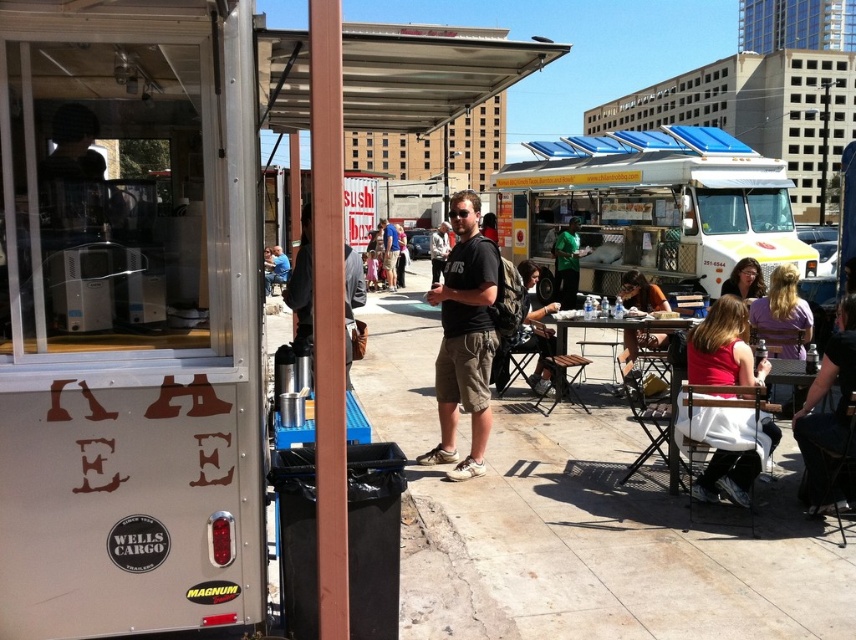
Question: Which point is farther from the camera taking this photo?

Choices:
 (A) 395,275
 (B) 554,337
 (C) 717,305
 (D) 486,285

Answer: (A)

Question: Is the position of camouflage jacket at center more distant than that of wooden table at center?

Choices:
 (A) yes
 (B) no

Answer: (A)

Question: Which object is positioned closest to the wooden table at center?

Choices:
 (A) matte black shirt at center
 (B) black cotton t-shirt at center
 (C) camouflage jacket at center

Answer: (C)

Question: Which point is farther to the camera?

Choices:
 (A) black cotton t-shirt at center
 (B) matte pink shirt at lower right

Answer: (A)

Question: Does white matte food truck at center appear under dark gray backpack at center?

Choices:
 (A) yes
 (B) no

Answer: (B)

Question: Can you confirm if black cotton t-shirt at center is thinner than matte brown hair at center?

Choices:
 (A) yes
 (B) no

Answer: (B)